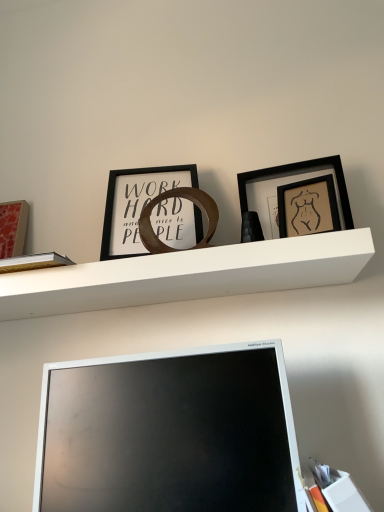
Find the location of a particular element. The image size is (384, 512). white paper at lower right is located at coordinates (338, 489).

Where is `matte red picture frame at left, placed as the first picture frame when sorted from left to right`? The height and width of the screenshot is (512, 384). matte red picture frame at left, placed as the first picture frame when sorted from left to right is located at coordinates (13, 228).

Measure the distance between point (16, 226) and camera.

Point (16, 226) is 1.22 meters away from camera.

Locate an element on the screen. The image size is (384, 512). white matte shelf at center is located at coordinates pyautogui.click(x=187, y=275).

Locate an element on the screen. black matte picture frame at center, which is counted as the second picture frame, starting from the left is located at coordinates pyautogui.click(x=136, y=204).

From a real-world perspective, relative to matte black picture frame at upper right, the first picture frame from the right, is matte red picture frame at left, the third picture frame viewed from the right, vertically above or below?

matte red picture frame at left, the third picture frame viewed from the right, is above matte black picture frame at upper right, the first picture frame from the right.

From the image's perspective, which one is positioned lower, matte red picture frame at left, placed as the first picture frame when sorted from left to right, or matte black picture frame at upper right, the first picture frame from the right?

matte red picture frame at left, placed as the first picture frame when sorted from left to right, from the image's perspective.

Looking at the image, does matte red picture frame at left, placed as the first picture frame when sorted from left to right, seem bigger or smaller compared to matte black picture frame at upper right, the first picture frame from the right?

Considering their sizes, matte red picture frame at left, placed as the first picture frame when sorted from left to right, takes up less space than matte black picture frame at upper right, the first picture frame from the right.

Is matte silver monitor at lower center aimed at matte black picture frame at upper right, which ranks as the 3th picture frame in left-to-right order?

No.

Consider the image. Do you think matte silver monitor at lower center is within matte black picture frame at upper right, the first picture frame from the right, or outside of it?

matte silver monitor at lower center is not inside matte black picture frame at upper right, the first picture frame from the right, it's outside.

Considering the sizes of matte silver monitor at lower center and matte black picture frame at upper right, which ranks as the 3th picture frame in left-to-right order, in the image, is matte silver monitor at lower center wider or thinner than matte black picture frame at upper right, which ranks as the 3th picture frame in left-to-right order,?

Clearly, matte silver monitor at lower center has more width compared to matte black picture frame at upper right, which ranks as the 3th picture frame in left-to-right order.

Is matte silver monitor at lower center bigger than matte black picture frame at upper right, which ranks as the 3th picture frame in left-to-right order?

Yes, matte silver monitor at lower center is bigger than matte black picture frame at upper right, which ranks as the 3th picture frame in left-to-right order.

Is white matte shelf at center in contact with black matte picture frame at center, which is counted as the second picture frame, starting from the left?

No, white matte shelf at center is not beside black matte picture frame at center, which is counted as the second picture frame, starting from the left.

Between white matte shelf at center and black matte picture frame at center, which is counted as the second picture frame, starting from the left, which one is positioned in front?

white matte shelf at center is closer to the camera.

Considering the relative sizes of white matte shelf at center and black matte picture frame at center, the 2th picture frame positioned from the right, in the image provided, is white matte shelf at center shorter than black matte picture frame at center, the 2th picture frame positioned from the right,?

Yes.

Which is nearer, (311, 464) or (10, 206)?

The point (311, 464) is in front.

This screenshot has width=384, height=512. I want to click on the 3rd picture frame behind the white paper at lower right, starting your count from the anchor, so click(x=13, y=228).

Considering the relative sizes of white paper at lower right and matte red picture frame at left, the third picture frame viewed from the right, in the image provided, is white paper at lower right smaller than matte red picture frame at left, the third picture frame viewed from the right,?

No.

From the image's perspective, is white paper at lower right under matte red picture frame at left, placed as the first picture frame when sorted from left to right?

Correct, white paper at lower right appears lower than matte red picture frame at left, placed as the first picture frame when sorted from left to right, in the image.

Could you measure the distance between matte red picture frame at left, the third picture frame viewed from the right, and white paper at lower right?

matte red picture frame at left, the third picture frame viewed from the right, and white paper at lower right are 96.88 centimeters apart from each other.

Based on the photo, is matte red picture frame at left, placed as the first picture frame when sorted from left to right, placed right next to white paper at lower right?

No, matte red picture frame at left, placed as the first picture frame when sorted from left to right, is not next to white paper at lower right.

In the scene shown: Could you tell me if matte red picture frame at left, placed as the first picture frame when sorted from left to right, is turned towards white paper at lower right?

No, matte red picture frame at left, placed as the first picture frame when sorted from left to right, is not turned towards white paper at lower right.

How different are the orientations of matte red picture frame at left, the third picture frame viewed from the right, and white paper at lower right in degrees?

The facing directions of matte red picture frame at left, the third picture frame viewed from the right, and white paper at lower right are 0.285 degrees apart.

Considering the sizes of objects matte red picture frame at left, the third picture frame viewed from the right, and matte silver monitor at lower center in the image provided, who is bigger, matte red picture frame at left, the third picture frame viewed from the right, or matte silver monitor at lower center?

matte silver monitor at lower center is bigger.

Which of these two, matte red picture frame at left, placed as the first picture frame when sorted from left to right, or matte silver monitor at lower center, stands shorter?

matte red picture frame at left, placed as the first picture frame when sorted from left to right.

Is matte red picture frame at left, placed as the first picture frame when sorted from left to right, located outside matte silver monitor at lower center?

Yes, matte red picture frame at left, placed as the first picture frame when sorted from left to right, is outside of matte silver monitor at lower center.

Is matte red picture frame at left, placed as the first picture frame when sorted from left to right, positioned behind matte silver monitor at lower center?

Yes, matte red picture frame at left, placed as the first picture frame when sorted from left to right, is further from the camera.

Where is `shelf below the matte red picture frame at left, placed as the first picture frame when sorted from left to right (from the image's perspective)`? shelf below the matte red picture frame at left, placed as the first picture frame when sorted from left to right (from the image's perspective) is located at coordinates (187, 275).

From the image's perspective, between white matte shelf at center and matte red picture frame at left, the third picture frame viewed from the right, which one is located above?

From the image's view, matte red picture frame at left, the third picture frame viewed from the right, is above.

Is white matte shelf at center at the right side of matte red picture frame at left, the third picture frame viewed from the right?

Yes.

From a real-world perspective, is white matte shelf at center above or below matte red picture frame at left, the third picture frame viewed from the right?

white matte shelf at center is situated lower than matte red picture frame at left, the third picture frame viewed from the right, in the real world.

From the matte red picture frame at left, placed as the first picture frame when sorted from left to right, count 2nd picture frame to the right and point to it. Please provide its 2D coordinates.

[(287, 184)]

This screenshot has height=512, width=384. What are the coordinates of `computer monitor below the matte black picture frame at upper right, the first picture frame from the right (from the image's perspective)` in the screenshot? It's located at [x=169, y=434].

Which object lies nearer to the anchor point white matte shelf at center, matte red picture frame at left, placed as the first picture frame when sorted from left to right, or black matte picture frame at center, which is counted as the second picture frame, starting from the left?

black matte picture frame at center, which is counted as the second picture frame, starting from the left, is closer to white matte shelf at center.

From the image, which object appears to be nearer to matte red picture frame at left, placed as the first picture frame when sorted from left to right, white paper at lower right or matte silver monitor at lower center?

matte silver monitor at lower center is closer to matte red picture frame at left, placed as the first picture frame when sorted from left to right.

From the image, which object appears to be nearer to matte silver monitor at lower center, white matte shelf at center or matte red picture frame at left, the third picture frame viewed from the right?

Based on the image, white matte shelf at center appears to be nearer to matte silver monitor at lower center.

Which object lies nearer to the anchor point white matte shelf at center, matte silver monitor at lower center or black matte picture frame at center, the 2th picture frame positioned from the right?

Based on the image, black matte picture frame at center, the 2th picture frame positioned from the right, appears to be nearer to white matte shelf at center.

Estimate the real-world distances between objects in this image. Which object is closer to white matte shelf at center, black matte picture frame at center, which is counted as the second picture frame, starting from the left, or matte black picture frame at upper right, the first picture frame from the right?

black matte picture frame at center, which is counted as the second picture frame, starting from the left, is positioned closer to the anchor white matte shelf at center.

From the image, which object appears to be nearer to white matte shelf at center, matte red picture frame at left, placed as the first picture frame when sorted from left to right, or matte silver monitor at lower center?

matte silver monitor at lower center is closer to white matte shelf at center.

In the scene shown: Estimate the real-world distances between objects in this image. Which object is closer to black matte picture frame at center, which is counted as the second picture frame, starting from the left, matte black picture frame at upper right, which ranks as the 3th picture frame in left-to-right order, or matte silver monitor at lower center?

matte black picture frame at upper right, which ranks as the 3th picture frame in left-to-right order, is closer to black matte picture frame at center, which is counted as the second picture frame, starting from the left.

Which object lies further to the anchor point matte red picture frame at left, the third picture frame viewed from the right, matte black picture frame at upper right, the first picture frame from the right, or matte silver monitor at lower center?

Among the two, matte black picture frame at upper right, the first picture frame from the right, is located further to matte red picture frame at left, the third picture frame viewed from the right.

Where is `computer monitor between white matte shelf at center and white paper at lower right from top to bottom`? The image size is (384, 512). computer monitor between white matte shelf at center and white paper at lower right from top to bottom is located at coordinates (169, 434).

Identify the location of shelf between black matte picture frame at center, the 2th picture frame positioned from the right, and matte silver monitor at lower center from top to bottom. This screenshot has height=512, width=384. (187, 275).

Where is `picture frame located between matte red picture frame at left, the third picture frame viewed from the right, and matte silver monitor at lower center in the left-right direction`? picture frame located between matte red picture frame at left, the third picture frame viewed from the right, and matte silver monitor at lower center in the left-right direction is located at coordinates (136, 204).

Find the location of a particular element. This screenshot has height=512, width=384. shelf between matte red picture frame at left, the third picture frame viewed from the right, and white paper at lower right is located at coordinates (187, 275).